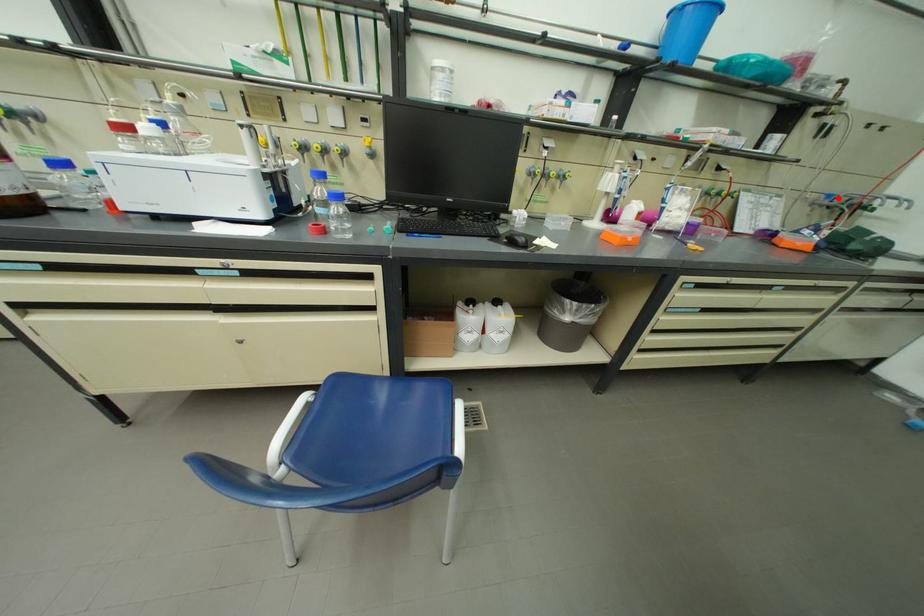
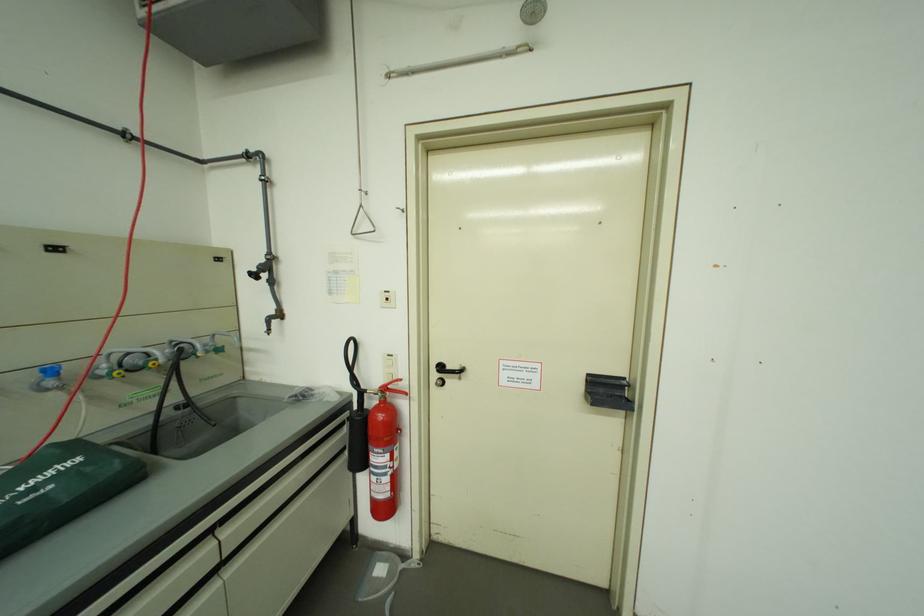
In the second image, find the point that corresponds to the highlighted location in the first image.

(62, 373)